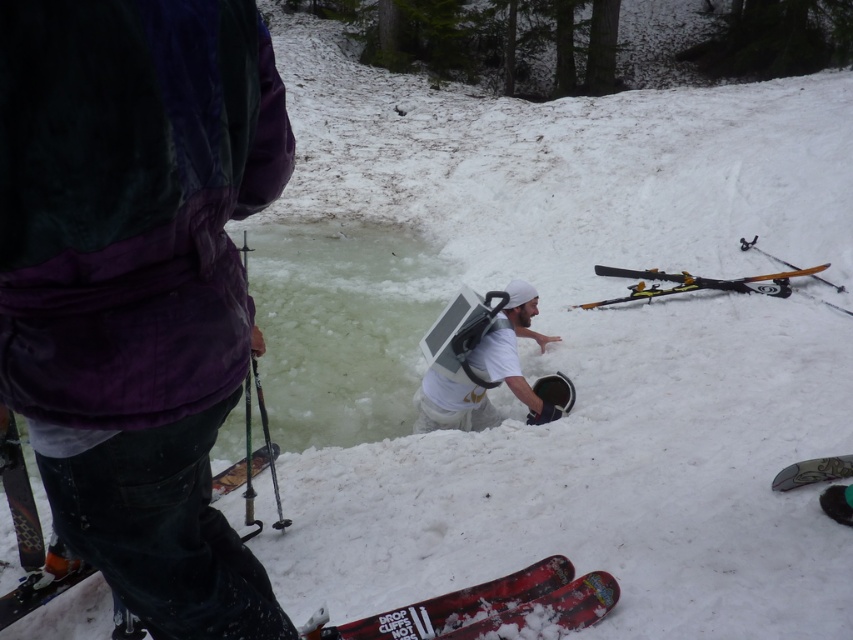
Question: Can you confirm if white matte laptop at center is thinner than green felt snowboard at lower right?

Choices:
 (A) yes
 (B) no

Answer: (B)

Question: Which object is farther from the camera taking this photo?

Choices:
 (A) white matte laptop at center
 (B) red matte snowboard at lower center
 (C) green felt snowboard at lower right
 (D) purple fleece jacket at upper left

Answer: (A)

Question: Which point is farther to the camera?

Choices:
 (A) (780, 476)
 (B) (131, 458)
 (C) (473, 628)
 (D) (415, 428)

Answer: (D)

Question: Where is purple fleece jacket at upper left located in relation to red matte snowboard at lower center in the image?

Choices:
 (A) above
 (B) below

Answer: (A)

Question: Which of the following is the closest to the observer?

Choices:
 (A) (549, 419)
 (B) (148, 348)

Answer: (B)

Question: Is white matte laptop at center wider than yellow metallic skis at upper right?

Choices:
 (A) no
 (B) yes

Answer: (A)